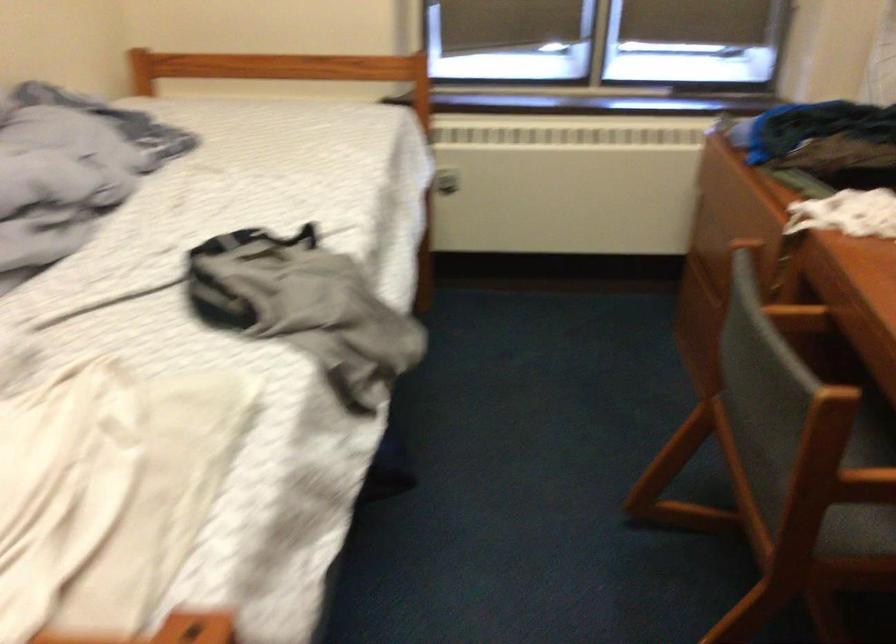
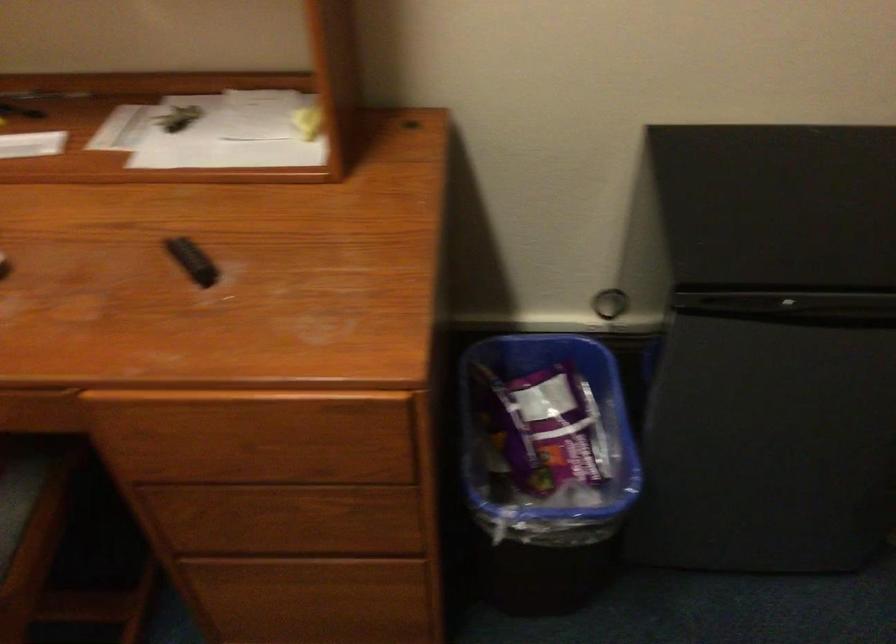
The images are taken continuously from a first-person perspective. In which direction is your viewpoint rotating?

The rotation direction of the camera is right-down.